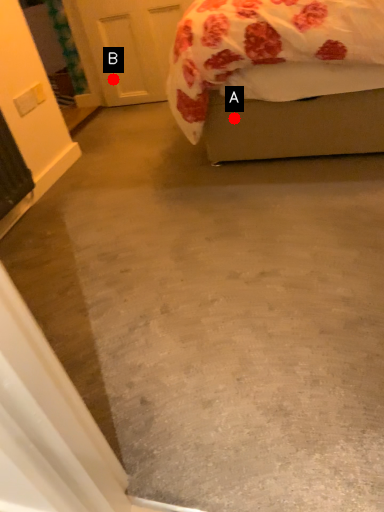
Question: Two points are circled on the image, labeled by A and B beside each circle. Which of the following is the closest to the observer?

Choices:
 (A) A is closer
 (B) B is closer

Answer: (A)